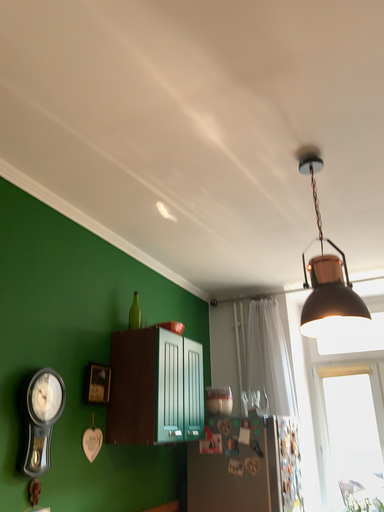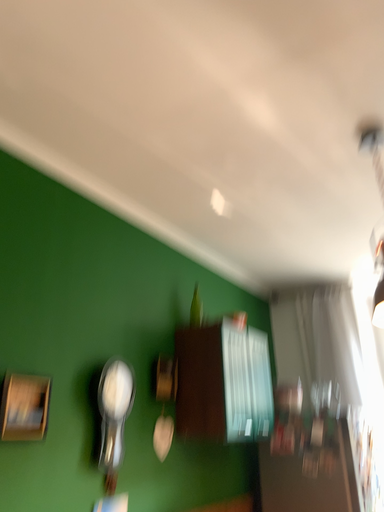
Question: Which way did the camera rotate in the video?

Choices:
 (A) rotated right
 (B) rotated left

Answer: (B)